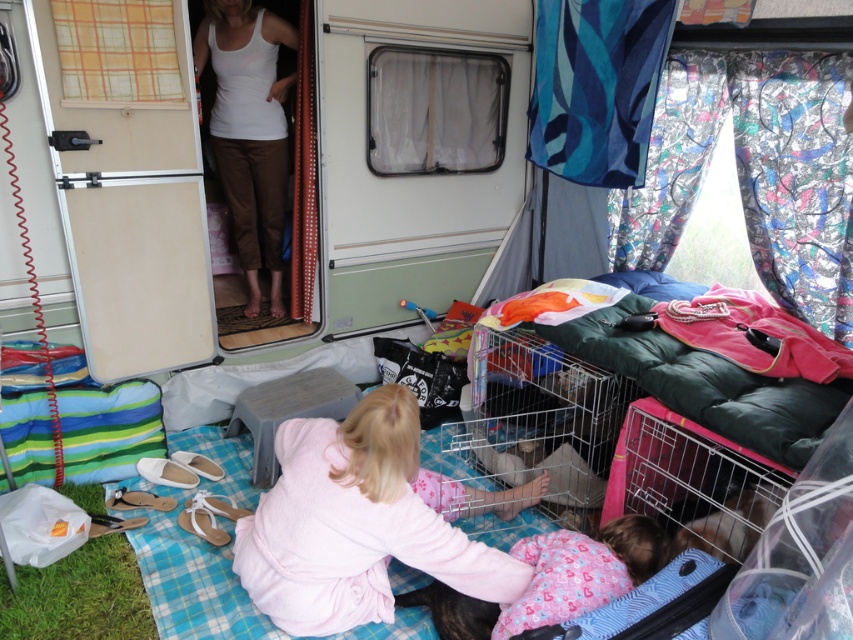
Can you confirm if pink fleece blanket at lower center is wider than white matte tank top at upper center?

Indeed, pink fleece blanket at lower center has a greater width compared to white matte tank top at upper center.

At what (x,y) coordinates should I click in order to perform the action: click on pink fleece blanket at lower center. Please return your answer as a coordinate pair (x, y). This screenshot has height=640, width=853. Looking at the image, I should click on (360, 522).